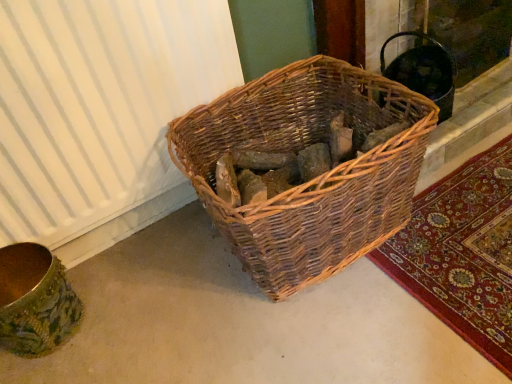
Image resolution: width=512 pixels, height=384 pixels. What are the coordinates of `vacant space to the left of woven brown basket at center` in the screenshot? It's located at (154, 305).